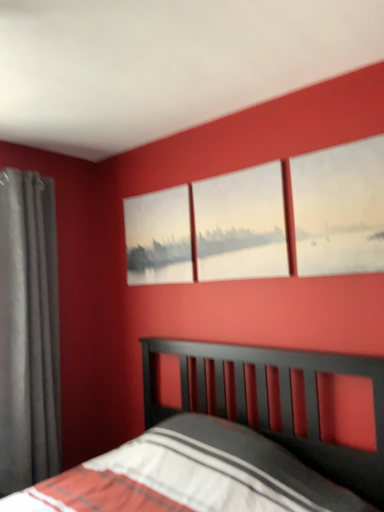
Question: Is matte canvas painting at center wider or thinner than matte canvas painting at upper right, positioned as the 1th window in front-to-back order?

Choices:
 (A) wide
 (B) thin

Answer: (A)

Question: Is matte canvas painting at center taller or shorter than matte canvas painting at upper right, arranged as the second window when viewed from the back?

Choices:
 (A) short
 (B) tall

Answer: (A)

Question: Which object is positioned closest to the matte canvas painting at upper right, positioned as the 1th window in front-to-back order?

Choices:
 (A) matte gray curtain at left
 (B) white matte painting at center, which appears as the 2th window when viewed from the front
 (C) matte canvas painting at center

Answer: (B)

Question: Estimate the real-world distances between objects in this image. Which object is closer to the white matte painting at center, acting as the first window starting from the back?

Choices:
 (A) matte canvas painting at center
 (B) matte canvas painting at upper right, positioned as the 1th window in front-to-back order
 (C) matte gray curtain at left

Answer: (B)